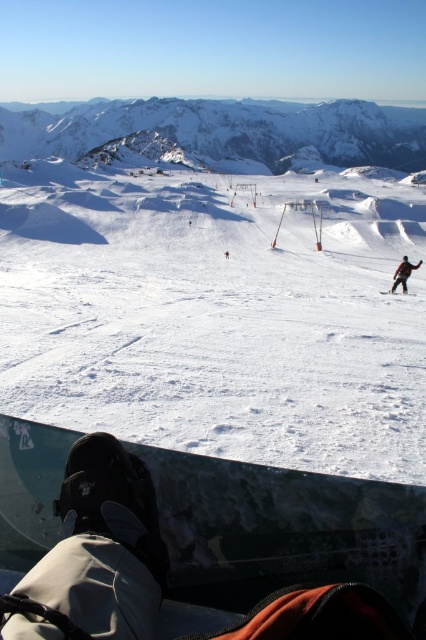
Question: Estimate the real-world distances between objects in this image. Which object is farther from the white powdery snow at center?

Choices:
 (A) shiny black snowboard at lower center
 (B) red ski suit at right
 (C) white snow-covered mountain at upper center

Answer: (C)

Question: Considering the real-world distances, which object is closest to the white snow-covered mountain at upper center?

Choices:
 (A) white powdery snow at center
 (B) shiny black snowboard at lower center

Answer: (A)

Question: Is white powdery snow at center smaller than shiny black snowboard at lower center?

Choices:
 (A) yes
 (B) no

Answer: (B)

Question: Which point appears farthest from the camera in this image?

Choices:
 (A) [x=262, y=480]
 (B) [x=17, y=131]

Answer: (B)

Question: In this image, where is white snow-covered mountain at upper center located relative to red ski suit at right?

Choices:
 (A) right
 (B) left

Answer: (A)

Question: Does shiny black snowboard at lower center appear on the right side of red ski suit at right?

Choices:
 (A) yes
 (B) no

Answer: (B)